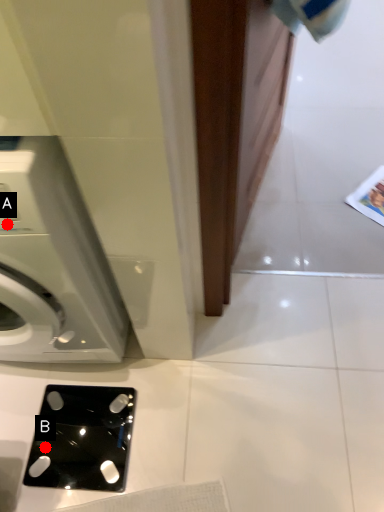
Question: Two points are circled on the image, labeled by A and B beside each circle. Which of the following is the closest to the observer?

Choices:
 (A) A is closer
 (B) B is closer

Answer: (A)